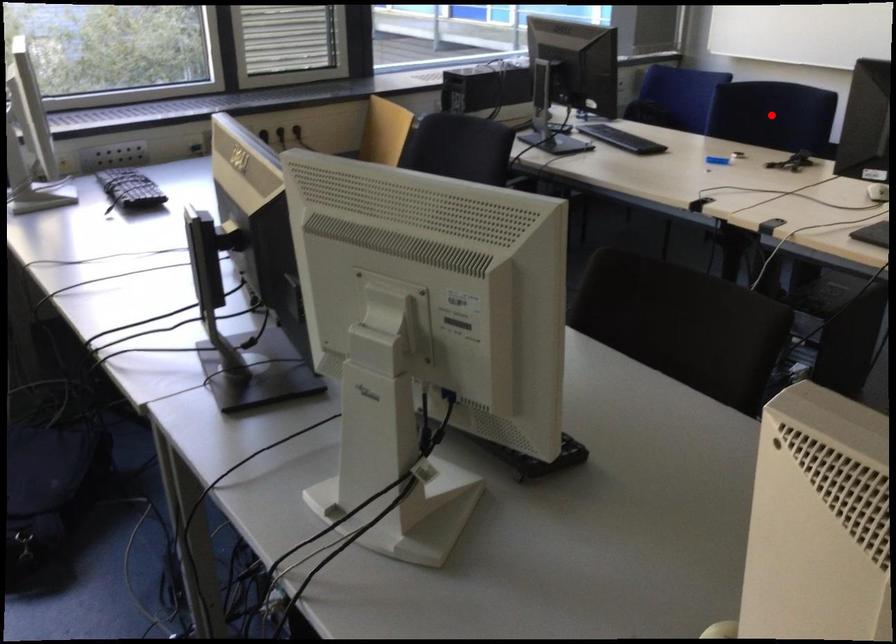
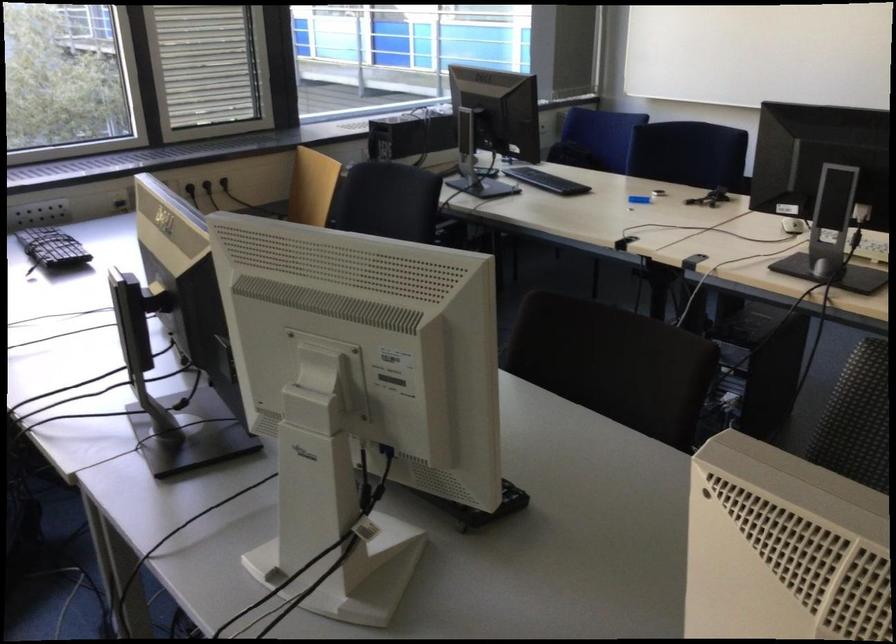
Where in the second image is the point corresponding to the highlighted location from the first image?

(687, 153)